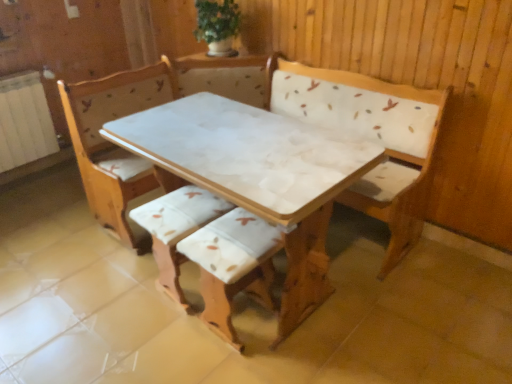
Image resolution: width=512 pixels, height=384 pixels. Describe the element at coordinates (233, 265) in the screenshot. I see `wooden armchair at center, marked as the second armchair in a left-to-right arrangement` at that location.

The height and width of the screenshot is (384, 512). I want to click on white marble table at center, so click(x=253, y=194).

You are a GUI agent. You are given a task and a screenshot of the screen. Output one action in this format:
    pyautogui.click(x=<x>, y=<y>)
    Task: Click on the green leafy plant at upper center
    
    Given the screenshot: What is the action you would take?
    pyautogui.click(x=217, y=20)

Is white marble table at center spatially inside green leafy plant at upper center, or outside of it?

Answer: white marble table at center is outside green leafy plant at upper center.

Does white marble table at center appear on the right side of green leafy plant at upper center?

Yes, white marble table at center is to the right of green leafy plant at upper center.

Is point (115, 140) more distant than point (234, 12)?

No, it is in front of (234, 12).

Does white marble table at center have a lesser width compared to green leafy plant at upper center?

No.

Considering the sizes of objects wooden armchair at center, which is the first armchair in right-to-left order, and green leafy plant at upper center in the image provided, who is taller, wooden armchair at center, which is the first armchair in right-to-left order, or green leafy plant at upper center?

wooden armchair at center, which is the first armchair in right-to-left order.

Which is more to the left, wooden armchair at center, marked as the second armchair in a left-to-right arrangement, or green leafy plant at upper center?

green leafy plant at upper center.

From a real-world perspective, is wooden armchair at center, marked as the second armchair in a left-to-right arrangement, beneath green leafy plant at upper center?

Yes, from a real-world perspective, wooden armchair at center, marked as the second armchair in a left-to-right arrangement, is beneath green leafy plant at upper center.

From the image's perspective, is wooden armchair at center, which is the first armchair in right-to-left order, located above or below green leafy plant at upper center?

wooden armchair at center, which is the first armchair in right-to-left order, is situated lower than green leafy plant at upper center in the image.

From a real-world perspective, is green leafy plant at upper center above or below white fabric cushion at center, which is the 2th armchair from right to left?

green leafy plant at upper center is above white fabric cushion at center, which is the 2th armchair from right to left.

How different are the orientations of green leafy plant at upper center and white fabric cushion at center, which is the first armchair in left-to-right order, in degrees?

86.1 degrees.

From the image's perspective, which object appears higher, green leafy plant at upper center or white fabric cushion at center, which is the 2th armchair from right to left?

green leafy plant at upper center is shown above in the image.

Consider the image. Is green leafy plant at upper center facing away from white marble table at center?

No, green leafy plant at upper center is not facing away from white marble table at center.

From the image's perspective, is green leafy plant at upper center below white marble table at center?

No, from the image's perspective, green leafy plant at upper center is not beneath white marble table at center.

Is green leafy plant at upper center at the left side of white marble table at center?

Yes, green leafy plant at upper center is to the left of white marble table at center.

Who is smaller, green leafy plant at upper center or white marble table at center?

With smaller size is green leafy plant at upper center.

Relative to wooden armchair at center, which is the first armchair in right-to-left order, is white fabric cushion at center, which is the 2th armchair from right to left, in front or behind?

Visually, white fabric cushion at center, which is the 2th armchair from right to left, is located behind wooden armchair at center, which is the first armchair in right-to-left order.

The image size is (512, 384). I want to click on armchair on the left of wooden armchair at center, marked as the second armchair in a left-to-right arrangement, so click(x=177, y=229).

Does white fabric cushion at center, which is the first armchair in left-to-right order, turn towards wooden armchair at center, marked as the second armchair in a left-to-right arrangement?

No, white fabric cushion at center, which is the first armchair in left-to-right order, is not aimed at wooden armchair at center, marked as the second armchair in a left-to-right arrangement.

Which of these two, white fabric cushion at center, which is the 2th armchair from right to left, or wooden armchair at center, which is the first armchair in right-to-left order, is thinner?

Thinner between the two is white fabric cushion at center, which is the 2th armchair from right to left.

In the scene shown: Relative to green leafy plant at upper center, is white fabric cushion at center, which is the first armchair in left-to-right order, in front or behind?

Visually, white fabric cushion at center, which is the first armchair in left-to-right order, is located in front of green leafy plant at upper center.

From the picture: Does white fabric cushion at center, which is the first armchair in left-to-right order, appear on the right side of green leafy plant at upper center?

In fact, white fabric cushion at center, which is the first armchair in left-to-right order, is to the left of green leafy plant at upper center.

Measure the distance between white fabric cushion at center, which is the 2th armchair from right to left, and green leafy plant at upper center.

white fabric cushion at center, which is the 2th armchair from right to left, is 3.88 feet from green leafy plant at upper center.

Is point (142, 207) positioned behind point (194, 30)?

No.

Which object is more forward, green leafy plant at upper center or wooden armchair at center, which is the first armchair in right-to-left order?

wooden armchair at center, which is the first armchair in right-to-left order, is in front.

Is green leafy plant at upper center far away from wooden armchair at center, which is the first armchair in right-to-left order?

Yes, green leafy plant at upper center and wooden armchair at center, which is the first armchair in right-to-left order, are quite far apart.

Considering the sizes of objects green leafy plant at upper center and wooden armchair at center, marked as the second armchair in a left-to-right arrangement, in the image provided, who is taller, green leafy plant at upper center or wooden armchair at center, marked as the second armchair in a left-to-right arrangement,?

With more height is wooden armchair at center, marked as the second armchair in a left-to-right arrangement.

Is green leafy plant at upper center bigger than wooden armchair at center, which is the first armchair in right-to-left order?

Incorrect, green leafy plant at upper center is not larger than wooden armchair at center, which is the first armchair in right-to-left order.

At what (x,y) coordinates should I click in order to perform the action: click on table in front of the green leafy plant at upper center. Please return your answer as a coordinate pair (x, y). Looking at the image, I should click on (253, 194).

Locate an element on the screen. This screenshot has width=512, height=384. plant above the wooden armchair at center, marked as the second armchair in a left-to-right arrangement (from a real-world perspective) is located at coordinates (217, 20).

Based on their spatial positions, is white fabric cushion at center, which is the 2th armchair from right to left, or wooden armchair at center, which is the first armchair in right-to-left order, further from white marble table at center?

The object further to white marble table at center is white fabric cushion at center, which is the 2th armchair from right to left.

Which object lies further to the anchor point white fabric cushion at center, which is the 2th armchair from right to left, green leafy plant at upper center or white marble table at center?

Among the two, green leafy plant at upper center is located further to white fabric cushion at center, which is the 2th armchair from right to left.

From the picture: When comparing their distances from wooden armchair at center, which is the first armchair in right-to-left order, does green leafy plant at upper center or white marble table at center seem further?

green leafy plant at upper center is further to wooden armchair at center, which is the first armchair in right-to-left order.

Based on their spatial positions, is wooden armchair at center, marked as the second armchair in a left-to-right arrangement, or white fabric cushion at center, which is the 2th armchair from right to left, further from green leafy plant at upper center?

Based on the image, wooden armchair at center, marked as the second armchair in a left-to-right arrangement, appears to be further to green leafy plant at upper center.

From the image, which object appears to be nearer to wooden armchair at center, which is the first armchair in right-to-left order, white fabric cushion at center, which is the first armchair in left-to-right order, or white marble table at center?

white marble table at center lies closer to wooden armchair at center, which is the first armchair in right-to-left order, than the other object.

Based on the photo, looking at the image, which one is located further to green leafy plant at upper center, white marble table at center or white fabric cushion at center, which is the 2th armchair from right to left?

white fabric cushion at center, which is the 2th armchair from right to left, is further to green leafy plant at upper center.

Estimate the real-world distances between objects in this image. Which object is further from white marble table at center, wooden armchair at center, which is the first armchair in right-to-left order, or white fabric cushion at center, which is the first armchair in left-to-right order?

white fabric cushion at center, which is the first armchair in left-to-right order, is positioned further to the anchor white marble table at center.

Consider the image. Considering their positions, is wooden armchair at center, which is the first armchair in right-to-left order, positioned closer to white fabric cushion at center, which is the 2th armchair from right to left, than white marble table at center?

The object closer to white fabric cushion at center, which is the 2th armchair from right to left, is wooden armchair at center, which is the first armchair in right-to-left order.

The image size is (512, 384). Find the location of `armchair between green leafy plant at upper center and wooden armchair at center, marked as the second armchair in a left-to-right arrangement, from top to bottom`. armchair between green leafy plant at upper center and wooden armchair at center, marked as the second armchair in a left-to-right arrangement, from top to bottom is located at coordinates (177, 229).

Locate an element on the screen. armchair between white marble table at center and white fabric cushion at center, which is the first armchair in left-to-right order, in the front-back direction is located at coordinates (233, 265).

You are a GUI agent. You are given a task and a screenshot of the screen. Output one action in this format:
    pyautogui.click(x=<x>, y=<y>)
    Task: Click on the table between green leafy plant at upper center and white fabric cushion at center, which is the first armchair in left-to-right order, in the vertical direction
    The width and height of the screenshot is (512, 384).
    Given the screenshot: What is the action you would take?
    pyautogui.click(x=253, y=194)

The image size is (512, 384). I want to click on table between green leafy plant at upper center and wooden armchair at center, which is the first armchair in right-to-left order, from top to bottom, so click(x=253, y=194).